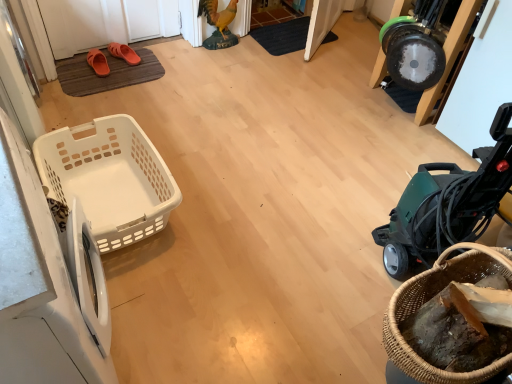
What are the coordinates of `free point to the right of orange rubber slipper at upper left, placed as the 1th footwear when sorted from left to right` in the screenshot? It's located at (133, 72).